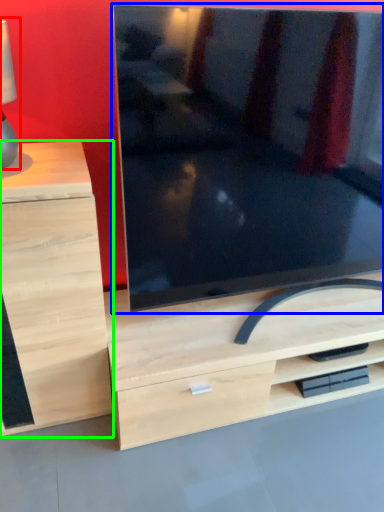
Question: Which object is the closest to the table lamp (highlighted by a red box)? Choose among these: television (highlighted by a blue box) or chest of drawers (highlighted by a green box).

Choices:
 (A) television
 (B) chest of drawers

Answer: (B)